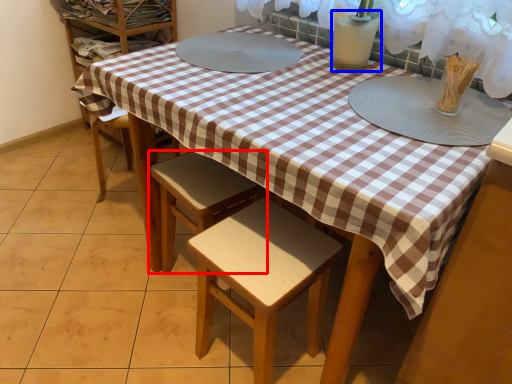
Question: Among these objects, which one is farthest to the camera, stool (highlighted by a red box) or glass vase (highlighted by a blue box)?

Choices:
 (A) stool
 (B) glass vase

Answer: (A)